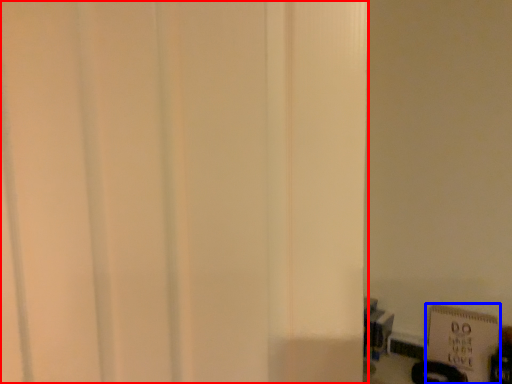
Question: Which object is further to the camera taking this photo, door (highlighted by a red box) or bulletin board (highlighted by a blue box)?

Choices:
 (A) door
 (B) bulletin board

Answer: (B)